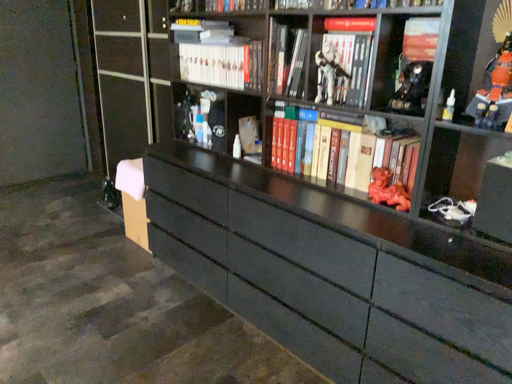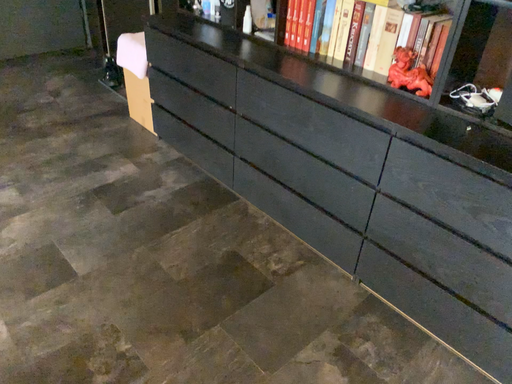
Question: How did the camera likely rotate when shooting the video?

Choices:
 (A) rotated upward
 (B) rotated downward

Answer: (B)